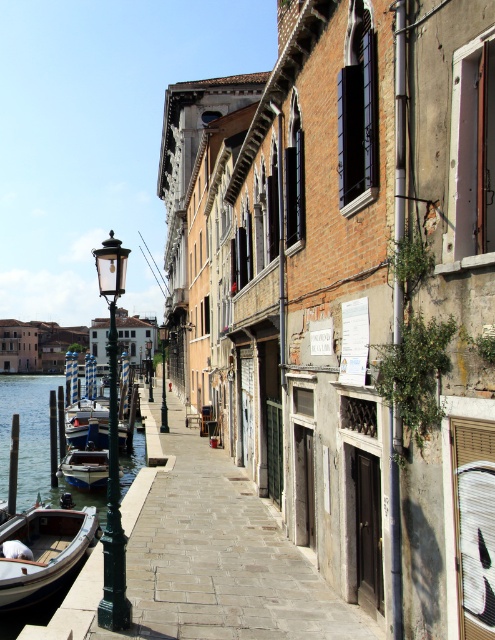
Question: Does wooden boat at lower left have a larger size compared to white glossy boat at lower left?

Choices:
 (A) yes
 (B) no

Answer: (B)

Question: Which point appears farthest from the camera in this image?

Choices:
 (A) (103, 272)
 (B) (32, 456)
 (C) (91, 544)
 (D) (89, 451)

Answer: (B)

Question: Which point appears farthest from the camera in this image?

Choices:
 (A) (114, 252)
 (B) (128, 483)

Answer: (B)

Question: Does clear water at dock left have a smaller size compared to wooden boat at lower left?

Choices:
 (A) no
 (B) yes

Answer: (A)

Question: Which point appears farthest from the camera in this image?

Choices:
 (A) pos(116,570)
 (B) pos(1,573)
 (C) pos(22,458)

Answer: (C)

Question: Can you confirm if wooden boat at lower left is thinner than white glossy boat at lower left?

Choices:
 (A) no
 (B) yes

Answer: (B)